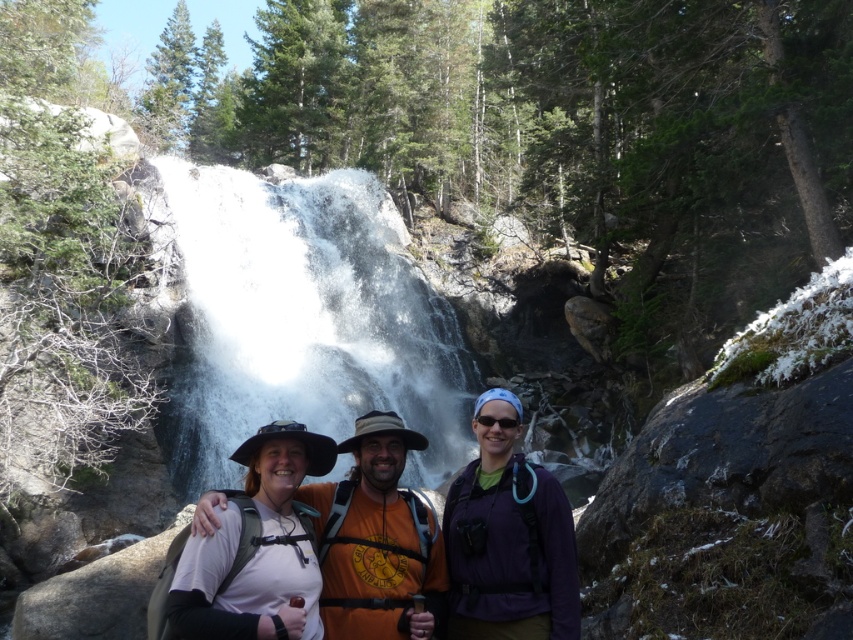
Can you confirm if white frothy water at center is taller than purple fabric backpack at center?

Indeed, white frothy water at center has a greater height compared to purple fabric backpack at center.

Which is more to the right, white frothy water at center or purple fabric backpack at center?

From the viewer's perspective, purple fabric backpack at center appears more on the right side.

Who is more distant from viewer, [357,330] or [531,540]?

The point [357,330] is behind.

Image resolution: width=853 pixels, height=640 pixels. In order to click on white frothy water at center in this screenshot , I will do `click(311, 316)`.

Which of these two, white fabric shirt at center or purple fabric backpack at center, stands shorter?

white fabric shirt at center

Can you confirm if white fabric shirt at center is positioned below purple fabric backpack at center?

Actually, white fabric shirt at center is above purple fabric backpack at center.

The width and height of the screenshot is (853, 640). What do you see at coordinates (518, 538) in the screenshot?
I see `white fabric shirt at center` at bounding box center [518, 538].

Find the location of a particular element. This screenshot has width=853, height=640. white fabric shirt at center is located at coordinates (518, 538).

Is white fabric shirt at center in front of white matte hat at center?

No, it is behind white matte hat at center.

Does white fabric shirt at center have a lesser width compared to white matte hat at center?

Incorrect, white fabric shirt at center's width is not less than white matte hat at center's.

Image resolution: width=853 pixels, height=640 pixels. What do you see at coordinates (518, 538) in the screenshot?
I see `white fabric shirt at center` at bounding box center [518, 538].

I want to click on white fabric shirt at center, so click(518, 538).